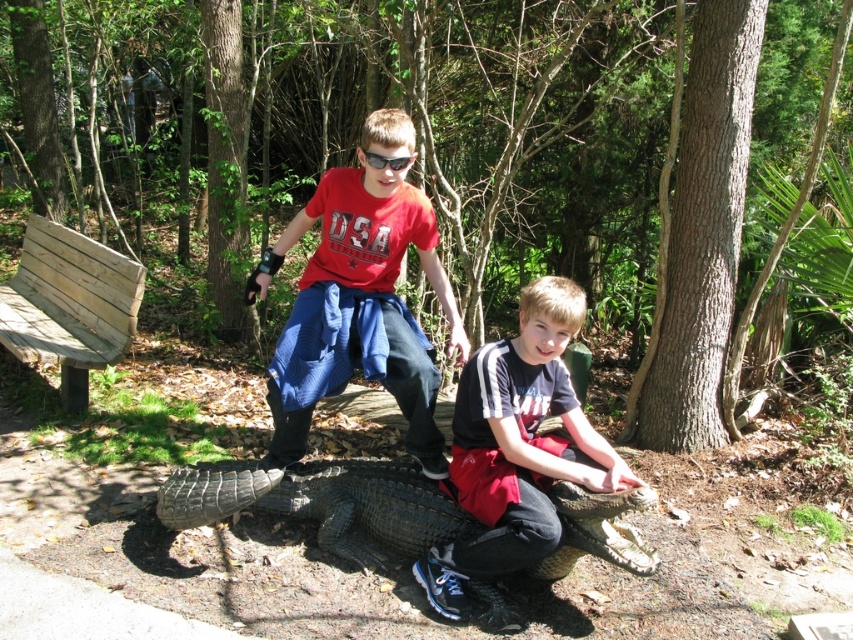
You are a photographer trying to capture a clear shot of the matte red shirt at center and dark blue denim jeans at lower center. Which object should you focus on first if you want to ensure both are in focus, considering their sizes?

The matte red shirt at center is bigger than dark blue denim jeans at lower center, so you should focus on the matte red shirt at center first to ensure both are in focus.

You are a photographer trying to capture the dark blue denim jeans at lower center and the dark gray scaly crocodile at center in a single shot. Which object should you focus on first to ensure both are in frame?

The dark blue denim jeans at lower center is bigger than the dark gray scaly crocodile at center, so you should focus on the dark gray scaly crocodile at center first to ensure both fit in the frame.

You are a photographer trying to capture a closeup shot of the dark gray scaly crocodile at center. You have a lens that can focus on objects as thin as 15 cm. Can the dark blue denim jeans at lower center interfere with your focus on the crocodile?

The dark blue denim jeans at lower center is thinner than the dark gray scaly crocodile at center. Since the jeans are thinner, they might not block the view completely, but you should check their exact positions to ensure they don not obstruct the crocodile.